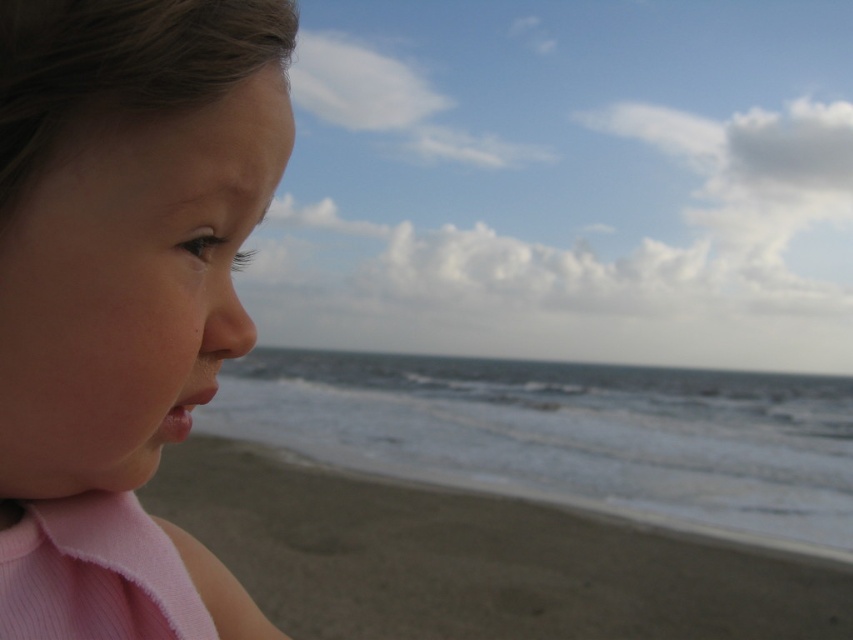
Question: Is the position of pink fabric at left less distant than that of smooth sand at lower left?

Choices:
 (A) no
 (B) yes

Answer: (B)

Question: Does pink fabric at left appear on the right side of smooth sand at lower left?

Choices:
 (A) yes
 (B) no

Answer: (A)

Question: Which point is closer to the camera?

Choices:
 (A) pink fabric at left
 (B) smooth sand at lower left

Answer: (A)

Question: Which of the following is the closest to the observer?

Choices:
 (A) 82,593
 (B) 653,580

Answer: (A)

Question: Is pink fabric at left to the left of smooth sand at lower left from the viewer's perspective?

Choices:
 (A) no
 (B) yes

Answer: (A)